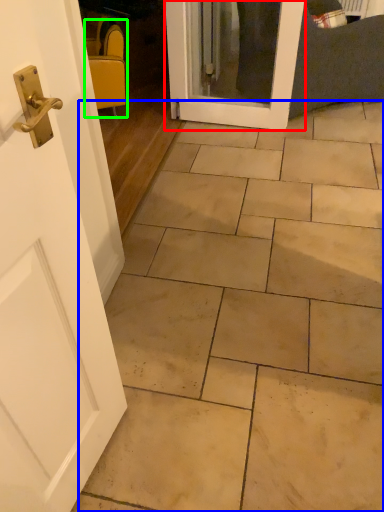
Question: Which object is positioned closest to door (highlighted by a red box)? Select from ceramic tile (highlighted by a blue box) and chair (highlighted by a green box).

Choices:
 (A) ceramic tile
 (B) chair

Answer: (B)